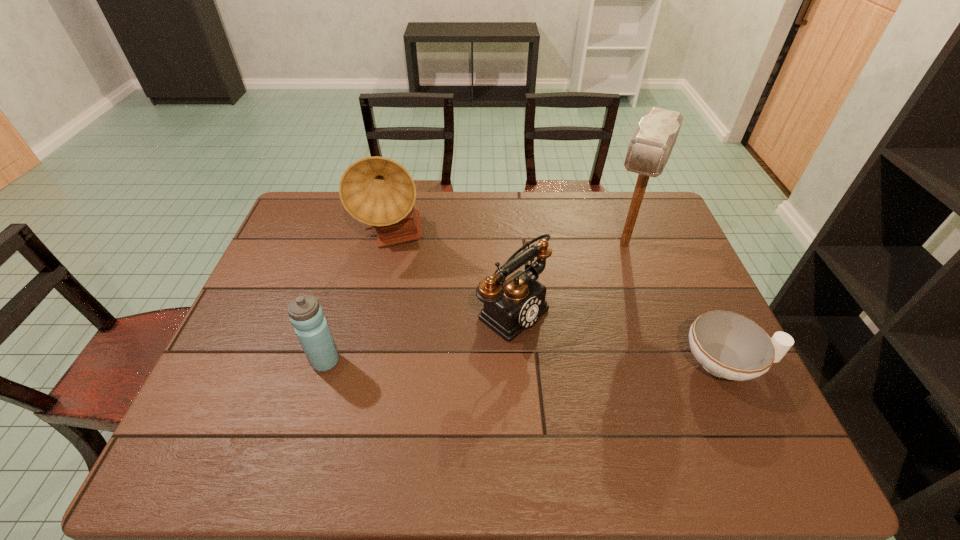
This screenshot has width=960, height=540. I want to click on free spot between the chinaware and the telephone, so click(x=620, y=336).

Find the location of a particular element. The image size is (960, 540). vacant point located between the mallet and the shortest object is located at coordinates (676, 303).

This screenshot has height=540, width=960. What are the coordinates of `free space between the mallet and the shortest object` in the screenshot? It's located at (676, 303).

Where is `vacant space that's between the telephone and the mallet`? The height and width of the screenshot is (540, 960). vacant space that's between the telephone and the mallet is located at coordinates (568, 276).

This screenshot has width=960, height=540. Identify the location of empty space between the third object from left to right and the chinaware. (620, 336).

At what (x,y) coordinates should I click in order to perform the action: click on vacant space in between the fourth shortest object and the telephone. Please return your answer as a coordinate pair (x, y). The image size is (960, 540). Looking at the image, I should click on (454, 274).

You are a GUI agent. You are given a task and a screenshot of the screen. Output one action in this format:
    pyautogui.click(x=<x>, y=<y>)
    Task: Click on the third closest object relative to the chinaware
    This screenshot has height=540, width=960.
    Given the screenshot: What is the action you would take?
    pyautogui.click(x=377, y=191)

Locate which object is the second closest to the chinaware. Please provide its 2D coordinates. Your answer should be formatted as a tuple, i.e. [(x, y)], where the tuple contains the x and y coordinates of a point satisfying the conditions above.

[(510, 306)]

Locate an element on the screen. free spot that satisfies the following two spatial constraints: 1. on the front side of the chinaware; 2. on the side with the handle of the phonograph record is located at coordinates (370, 363).

Where is `vacant area in the image that satisfies the following two spatial constraints: 1. on the front side of the third object from left to right; 2. on the right side of the fourth shortest object`? This screenshot has width=960, height=540. vacant area in the image that satisfies the following two spatial constraints: 1. on the front side of the third object from left to right; 2. on the right side of the fourth shortest object is located at coordinates (381, 308).